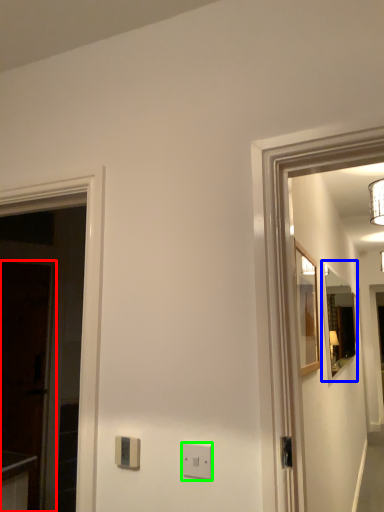
Question: Considering the real-world distances, which object is closest to glass door (highlighted by a red box)? mirror (highlighted by a blue box) or light switch (highlighted by a green box).

Choices:
 (A) mirror
 (B) light switch

Answer: (B)